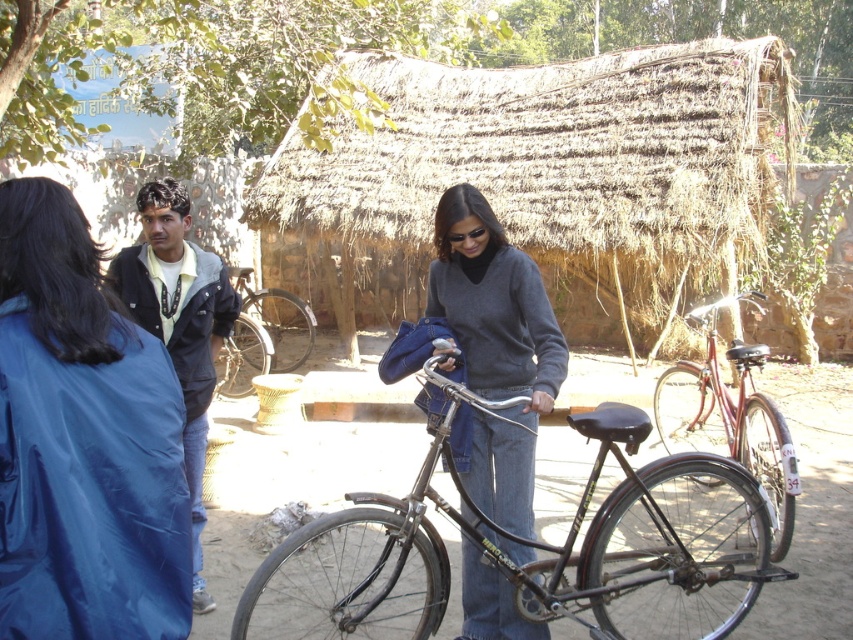
You are a photographer setting up a shot of two bicycles at the center of the scene. The scene includes a shiny metallic bicycle at center and a silver metallic bicycle at center. Which bicycle would require a narrower lens setting to capture its entire frame in the photo?

The shiny metallic bicycle at center is thinner than the silver metallic bicycle at center, so it would require a narrower lens setting to capture its entire frame in the photo.

Based on the scene description, where is the shiny metallic bicycle at center located in the image?

The shiny metallic bicycle at center is located at point (730, 420).